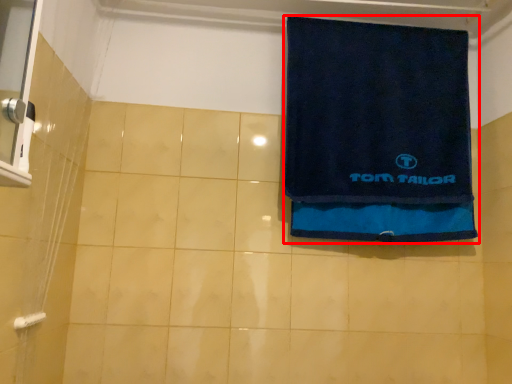
Question: Considering the relative positions of towel (annotated by the red box) and towel bar in the image provided, where is towel (annotated by the red box) located with respect to the staircase?

Choices:
 (A) right
 (B) left

Answer: (A)